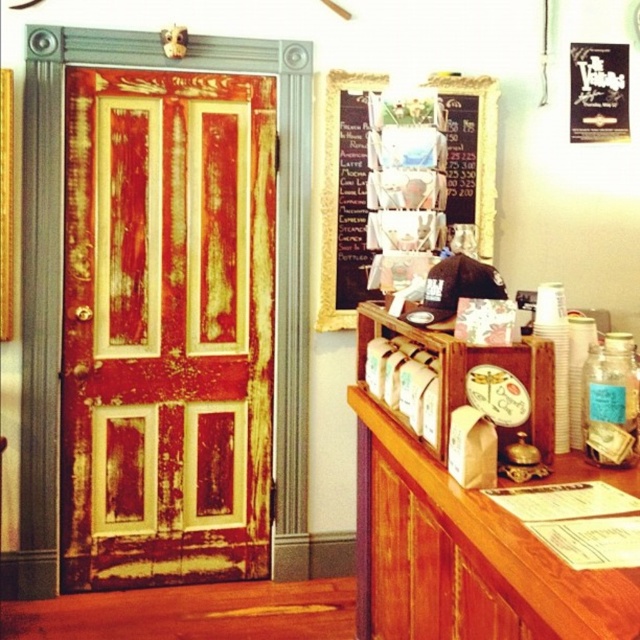
You are a customer entering the cozy cafe and want to read the chalkboard menu at upper center. Which direction should you move relative to the rusty wood door at left to get a better view?

To get a better view of the chalkboard menu at upper center, you should move towards the right side of the rusty wood door at left since the chalkboard menu is above and to the right of the door.

You are designing a layout for a new store and need to place a new sign that must be wider than the rusty wood door at left. Can the chalkboard menu at upper center, which is currently at upper center, be used as the sign? Explain why or why not based on their widths.

The rusty wood door at left is wider than the chalkboard menu at upper center. Since the sign needs to be wider than the door, the chalkboard menu at upper center cannot be used as it is narrower than the door.

You are standing in the cozy cafe and want to place a small decoration between the two points, point [227,86] and point [467,83]. Which point should you place it closer to so it appears larger to someone sitting at the counter?

You should place the decoration closer to point [227,86] because it is closer to the viewer, making objects placed there appear larger than those further away like point [467,83].